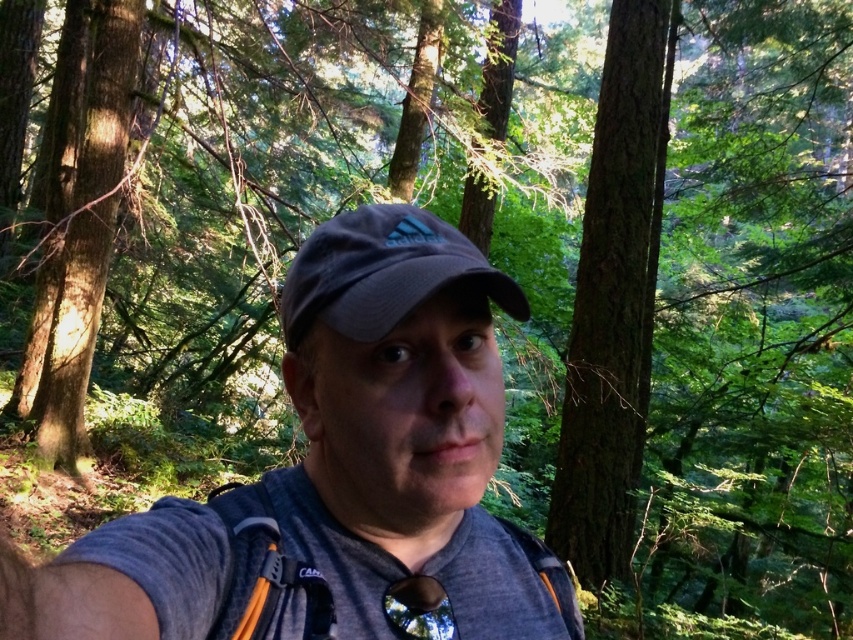
Question: Which is farther from the dark gray fabric cap at center?

Choices:
 (A) smooth bark tree at center
 (B) gray fabric cap at center

Answer: (A)

Question: Where is smooth bark tree at center located in relation to dark gray fabric cap at center in the image?

Choices:
 (A) right
 (B) left

Answer: (A)

Question: Which point is closer to the camera?

Choices:
 (A) (518, 310)
 (B) (618, 573)

Answer: (A)

Question: Which point is farther from the camera taking this photo?

Choices:
 (A) (426, 250)
 (B) (612, 577)

Answer: (B)

Question: Is gray fabric cap at center below smooth bark tree at center?

Choices:
 (A) yes
 (B) no

Answer: (A)

Question: Is gray fabric cap at center smaller than smooth bark tree at center?

Choices:
 (A) yes
 (B) no

Answer: (A)